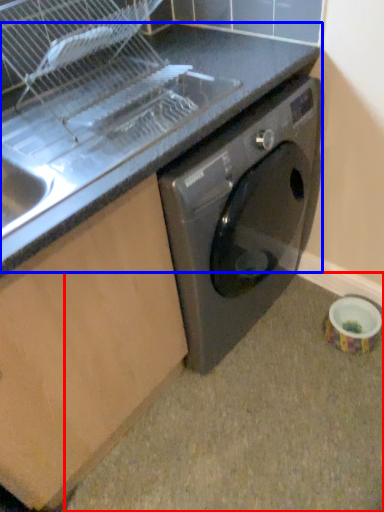
Question: Which object is closer to the camera taking this photo, granite (highlighted by a red box) or counter top (highlighted by a blue box)?

Choices:
 (A) granite
 (B) counter top

Answer: (B)